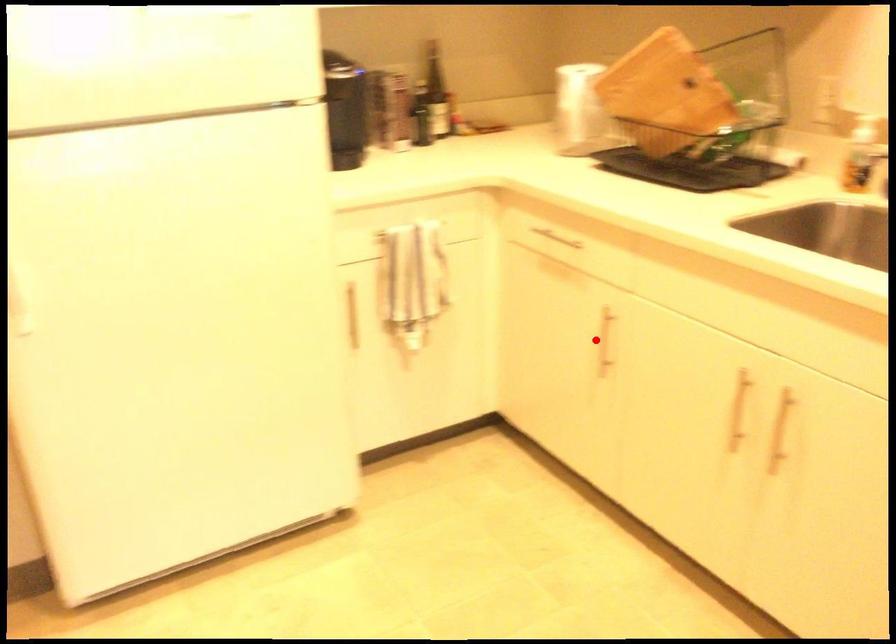
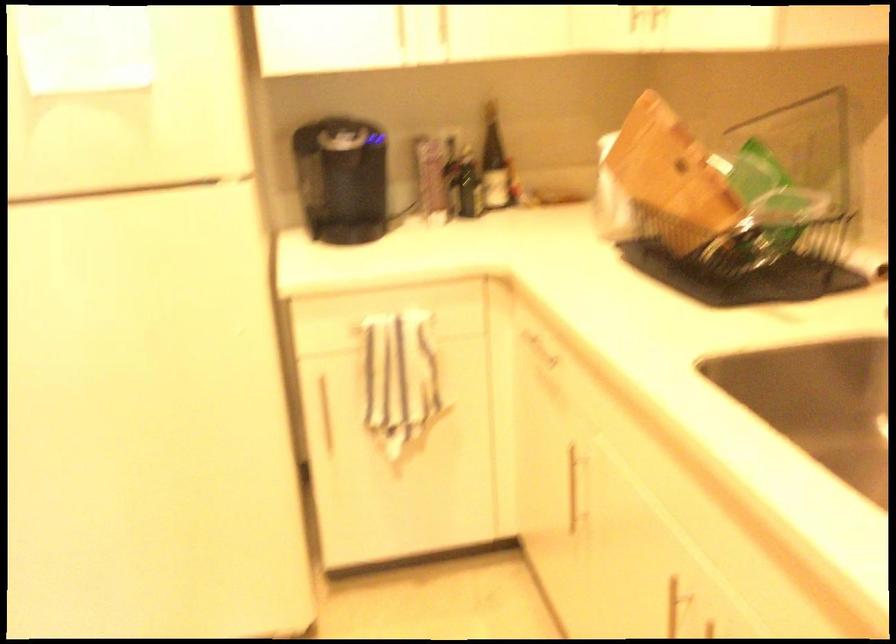
The point at the highlighted location is marked in the first image. Where is the corresponding point in the second image?

(576, 486)